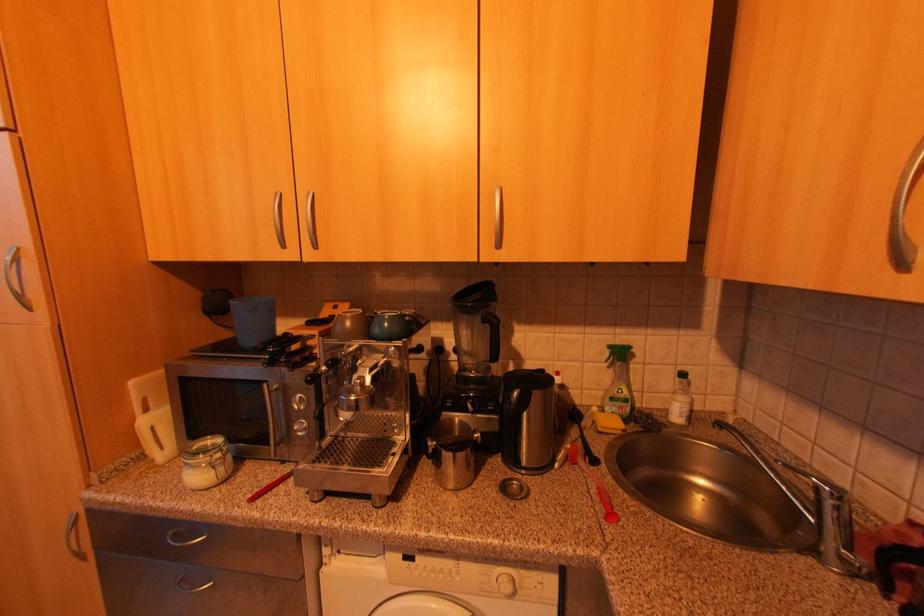
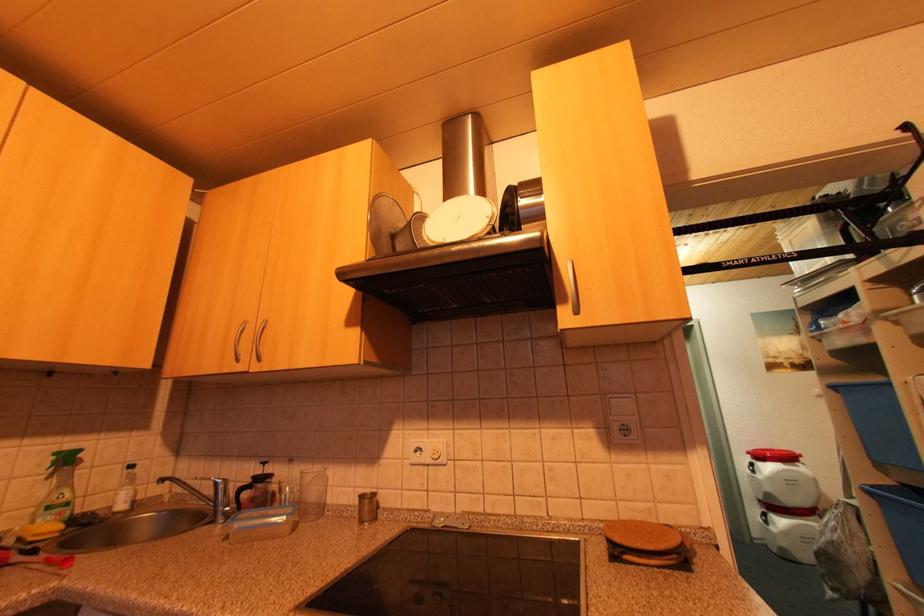
From the picture: How did the camera likely rotate?

The camera's rotation is toward right-up.